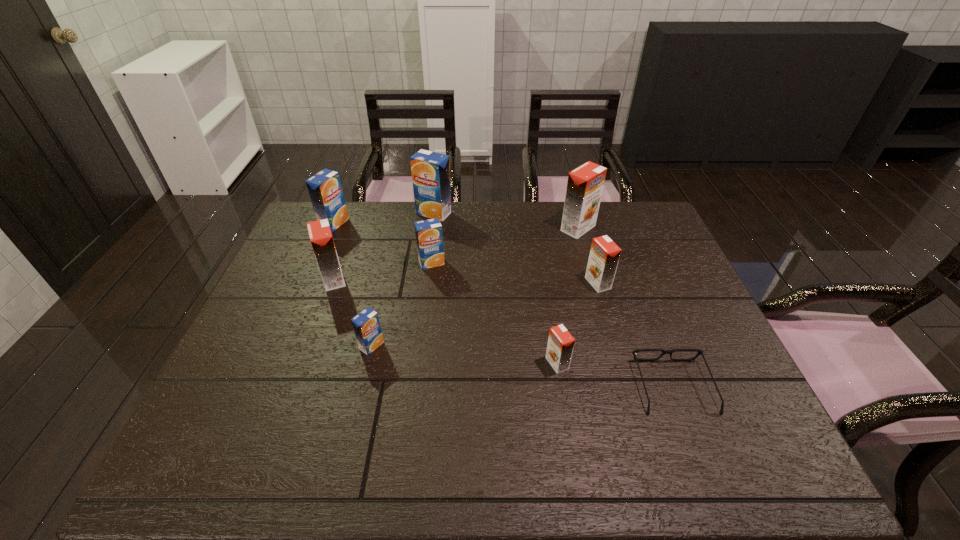
The width and height of the screenshot is (960, 540). What are the coordinates of `object that is the seventh nearest to the second smallest orange orange juice` in the screenshot? It's located at (321, 239).

Locate which orange juice ranks seventh in proximity to the leftmost orange orange juice. Please provide its 2D coordinates. Your answer should be formatted as a tuple, i.e. [(x, y)], where the tuple contains the x and y coordinates of a point satisfying the conditions above.

[(604, 255)]

In order to click on orange juice that is the third closest one to the leftmost orange orange juice in this screenshot , I will do `click(429, 236)`.

Where is `the second closest orange orange juice to the second biggest blue orange_juice`? The width and height of the screenshot is (960, 540). the second closest orange orange juice to the second biggest blue orange_juice is located at coordinates (585, 184).

Locate an element on the screen. Image resolution: width=960 pixels, height=540 pixels. the second closest orange orange juice to the leftmost blue orange_juice is located at coordinates (585, 184).

Locate an element on the screen. blue orange_juice that is the third closest to the leftmost orange orange juice is located at coordinates (429, 236).

Image resolution: width=960 pixels, height=540 pixels. I want to click on the fourth closest blue orange_juice to the third smallest orange orange juice, so click(430, 171).

Find the location of a particular element. The image size is (960, 540). blank space that satisfies the following two spatial constraints: 1. on the front side of the third biggest orange orange juice; 2. on the left side of the farthest orange orange juice is located at coordinates (593, 284).

At what (x,y) coordinates should I click in order to perform the action: click on free space that satisfies the following two spatial constraints: 1. on the front side of the biggest blue orange_juice; 2. on the right side of the second smallest blue orange_juice. Please return your answer as a coordinate pair (x, y). The height and width of the screenshot is (540, 960). Looking at the image, I should click on (427, 262).